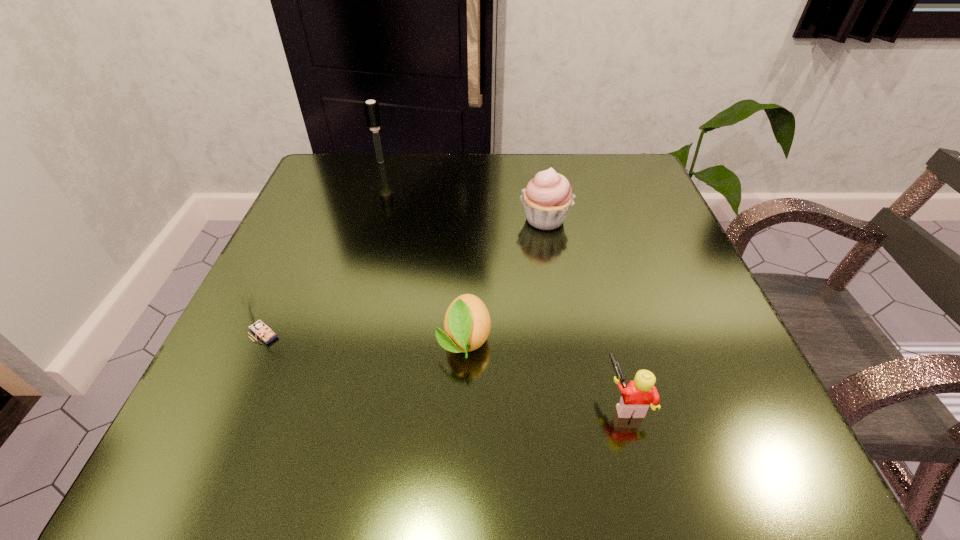
Where is `vacant space positioned in front of the nearest object with the accessory visible`? The width and height of the screenshot is (960, 540). vacant space positioned in front of the nearest object with the accessory visible is located at coordinates (408, 401).

This screenshot has height=540, width=960. What are the coordinates of `free location located in front of the nearest object with the accessory visible` in the screenshot? It's located at (532, 401).

Locate an element on the screen. The width and height of the screenshot is (960, 540). vacant space situated 0.400m on the right of the matchbox is located at coordinates (536, 333).

Find the location of `vacant space located with leaves positioned above the lemon`. vacant space located with leaves positioned above the lemon is located at coordinates (460, 470).

Image resolution: width=960 pixels, height=540 pixels. What are the coordinates of `hairbrush that is at the far edge` in the screenshot? It's located at (372, 111).

At what (x,y) coordinates should I click in order to perform the action: click on cupcake situated at the far edge. Please return your answer as a coordinate pair (x, y). Image resolution: width=960 pixels, height=540 pixels. Looking at the image, I should click on (547, 199).

Find the location of a particular element. The width and height of the screenshot is (960, 540). object present at the near edge is located at coordinates (637, 396).

At what (x,y) coordinates should I click in order to perform the action: click on hairbrush present at the left edge. Please return your answer as a coordinate pair (x, y). Image resolution: width=960 pixels, height=540 pixels. Looking at the image, I should click on (372, 111).

Identify the location of matchbox located at the left edge. This screenshot has height=540, width=960. (260, 329).

In order to click on object present at the right edge in this screenshot , I will do `click(637, 396)`.